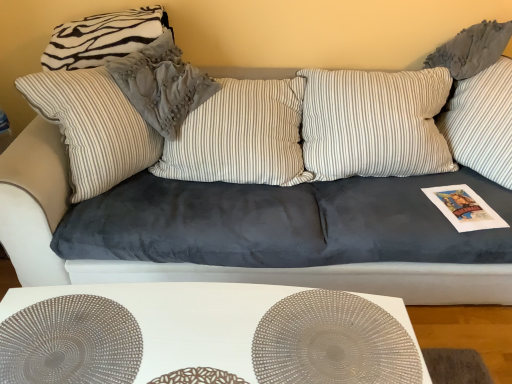
Question: Is zebra-patterned fabric pillow at upper left, which is counted as the 1th pillow, starting from the left, bigger than striped fabric pillow at upper left, arranged as the second pillow when viewed from the left?

Choices:
 (A) no
 (B) yes

Answer: (A)

Question: Can you confirm if zebra-patterned fabric pillow at upper left, which is counted as the 1th pillow, starting from the left, is thinner than striped fabric pillow at upper left, arranged as the second pillow when viewed from the left?

Choices:
 (A) yes
 (B) no

Answer: (A)

Question: Can we say zebra-patterned fabric pillow at upper left, which is counted as the 1th pillow, starting from the left, lies outside striped fabric pillow at upper left, arranged as the second pillow when viewed from the left?

Choices:
 (A) no
 (B) yes

Answer: (B)

Question: Could you tell me if zebra-patterned fabric pillow at upper left, which ranks as the second pillow in right-to-left order, is turned towards striped fabric pillow at upper left, arranged as the second pillow when viewed from the left?

Choices:
 (A) yes
 (B) no

Answer: (A)

Question: Is zebra-patterned fabric pillow at upper left, which is counted as the 1th pillow, starting from the left, smaller than striped fabric pillow at upper left, which ranks as the 1th pillow in right-to-left order?

Choices:
 (A) no
 (B) yes

Answer: (B)

Question: Is satin silver circle at center, which is the first circle from left to right, wider or thinner than white matte table at lower center?

Choices:
 (A) wide
 (B) thin

Answer: (A)

Question: Based on their sizes in the image, would you say satin silver circle at center, marked as the second circle in a right-to-left arrangement, is bigger or smaller than white matte table at lower center?

Choices:
 (A) small
 (B) big

Answer: (A)

Question: From the image's perspective, is satin silver circle at center, marked as the second circle in a right-to-left arrangement, above or below white matte table at lower center?

Choices:
 (A) below
 (B) above

Answer: (B)

Question: Considering their positions, is satin silver circle at center, marked as the second circle in a right-to-left arrangement, located in front of or behind white matte table at lower center?

Choices:
 (A) front
 (B) behind

Answer: (A)

Question: Is point (16, 354) closer or farther from the camera than point (39, 375)?

Choices:
 (A) closer
 (B) farther

Answer: (B)

Question: From the image's perspective, is white matte table at lower center positioned above or below satin silver circle at center, marked as the second circle in a right-to-left arrangement?

Choices:
 (A) above
 (B) below

Answer: (B)

Question: Considering the relative positions of white matte table at lower center and satin silver circle at center, marked as the second circle in a right-to-left arrangement, in the image provided, is white matte table at lower center to the left or to the right of satin silver circle at center, marked as the second circle in a right-to-left arrangement,?

Choices:
 (A) right
 (B) left

Answer: (A)

Question: Is white matte table at lower center situated inside satin silver circle at center, which is the first circle from left to right, or outside?

Choices:
 (A) outside
 (B) inside

Answer: (A)

Question: From a real-world perspective, relative to striped fabric pillow at upper left, which ranks as the 1th pillow in right-to-left order, is white matte table at lower center vertically above or below?

Choices:
 (A) below
 (B) above

Answer: (A)

Question: Relative to striped fabric pillow at upper left, arranged as the second pillow when viewed from the left, is white matte table at lower center in front or behind?

Choices:
 (A) behind
 (B) front

Answer: (B)